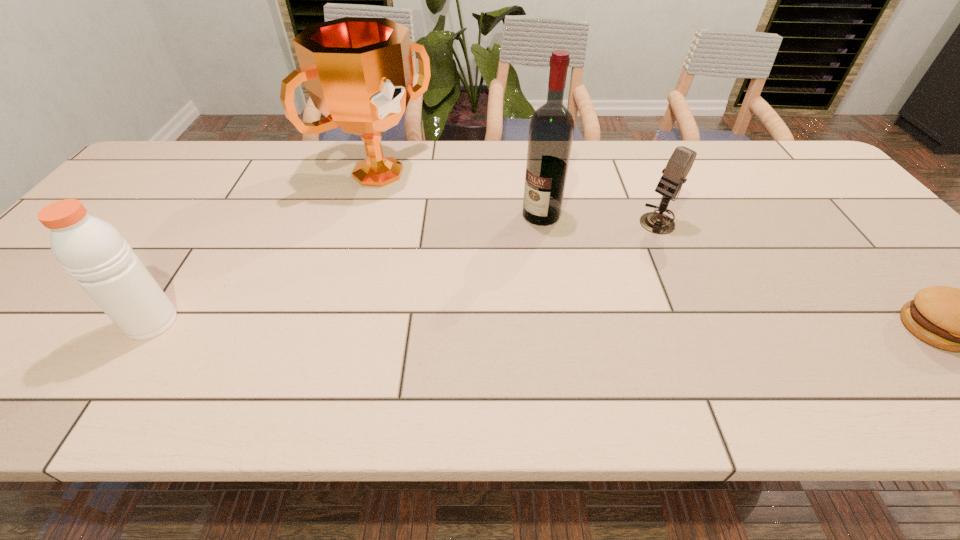
This screenshot has width=960, height=540. Identify the location of the leftmost object. (91, 250).

Where is `shaker`? This screenshot has width=960, height=540. shaker is located at coordinates (91, 250).

The height and width of the screenshot is (540, 960). What are the coordinates of `the third object from left to right` in the screenshot? It's located at (551, 129).

Where is `the second shortest object`? the second shortest object is located at coordinates (680, 163).

The image size is (960, 540). In order to click on microphone in this screenshot , I will do `click(680, 163)`.

This screenshot has height=540, width=960. What are the coordinates of `the farthest object` in the screenshot? It's located at (358, 71).

Where is `the fourth object from right to left`? The width and height of the screenshot is (960, 540). the fourth object from right to left is located at coordinates (358, 71).

Where is `free space located on the back of the shaker`? free space located on the back of the shaker is located at coordinates (193, 261).

Locate an element on the screen. The image size is (960, 540). vacant space situated on the front and back of the alcohol is located at coordinates (486, 266).

This screenshot has height=540, width=960. I want to click on vacant space located on the front and back of the alcohol, so click(x=457, y=293).